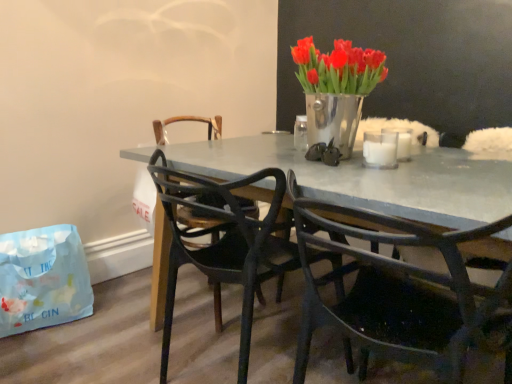
Question: Is black plastic chair at center, positioned as the first chair in left-to-right order, at the right side of light blue paper bag at lower left?

Choices:
 (A) no
 (B) yes

Answer: (B)

Question: Is black plastic chair at center, positioned as the second chair in right-to-left order, positioned behind light blue paper bag at lower left?

Choices:
 (A) yes
 (B) no

Answer: (B)

Question: Does black plastic chair at center, positioned as the first chair in left-to-right order, have a greater height compared to light blue paper bag at lower left?

Choices:
 (A) no
 (B) yes

Answer: (B)

Question: Is black plastic chair at center, positioned as the first chair in left-to-right order, completely or partially outside of light blue paper bag at lower left?

Choices:
 (A) no
 (B) yes

Answer: (B)

Question: Is light blue paper bag at lower left at the back of black plastic chair at center, positioned as the second chair in right-to-left order?

Choices:
 (A) yes
 (B) no

Answer: (B)

Question: Which is correct: metallic silver vase at upper center is inside black plastic chair at center, positioned as the second chair in right-to-left order, or outside of it?

Choices:
 (A) inside
 (B) outside

Answer: (B)

Question: From their relative heights in the image, would you say metallic silver vase at upper center is taller or shorter than black plastic chair at center, positioned as the second chair in right-to-left order?

Choices:
 (A) short
 (B) tall

Answer: (A)

Question: Considering the positions of metallic silver vase at upper center and black plastic chair at center, positioned as the second chair in right-to-left order, in the image, is metallic silver vase at upper center wider or thinner than black plastic chair at center, positioned as the second chair in right-to-left order,?

Choices:
 (A) wide
 (B) thin

Answer: (B)

Question: Relative to black plastic chair at center, positioned as the second chair in right-to-left order, is metallic silver vase at upper center in front or behind?

Choices:
 (A) behind
 (B) front

Answer: (A)

Question: Based on their sizes in the image, would you say black plastic chair at center, positioned as the first chair in left-to-right order, is bigger or smaller than white frosted glass candle at upper right, positioned as the 2th candle in front-to-back order?

Choices:
 (A) small
 (B) big

Answer: (B)

Question: From a real-world perspective, relative to white frosted glass candle at upper right, positioned as the 2th candle in front-to-back order, is black plastic chair at center, positioned as the first chair in left-to-right order, vertically above or below?

Choices:
 (A) above
 (B) below

Answer: (B)

Question: Is point (167, 284) positioned closer to the camera than point (397, 153)?

Choices:
 (A) farther
 (B) closer

Answer: (A)

Question: Considering the positions of black plastic chair at center, positioned as the second chair in right-to-left order, and white frosted glass candle at upper right, placed as the 1th candle when sorted from back to front, in the image, is black plastic chair at center, positioned as the second chair in right-to-left order, wider or thinner than white frosted glass candle at upper right, placed as the 1th candle when sorted from back to front,?

Choices:
 (A) wide
 (B) thin

Answer: (A)

Question: Is point (378, 135) positioned closer to the camera than point (354, 114)?

Choices:
 (A) closer
 (B) farther

Answer: (B)

Question: From their relative heights in the image, would you say white matte glass at upper center, placed as the 1th candle when sorted from front to back, is taller or shorter than metallic silver vase at upper center?

Choices:
 (A) short
 (B) tall

Answer: (A)